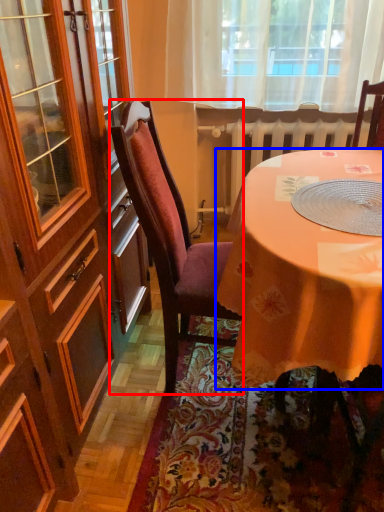
Question: Which point is closer to the camera, chair (highlighted by a red box) or desk (highlighted by a blue box)?

Choices:
 (A) chair
 (B) desk

Answer: (B)